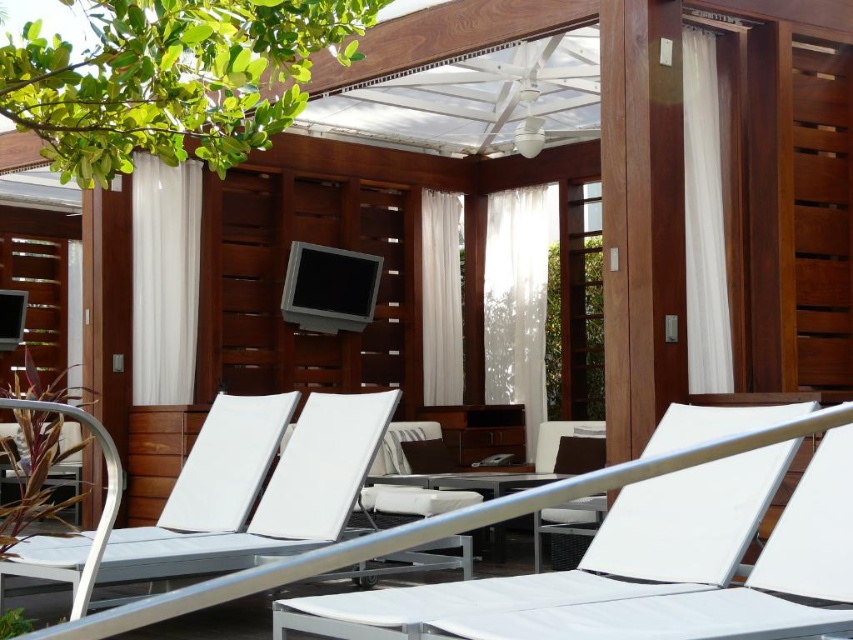
Does white fabric chair at center have a lesser width compared to white matte lounge chair at center?

In fact, white fabric chair at center might be wider than white matte lounge chair at center.

Does white fabric chair at center have a larger size compared to white matte lounge chair at center?

Indeed, white fabric chair at center has a larger size compared to white matte lounge chair at center.

What do you see at coordinates (585, 554) in the screenshot?
I see `white fabric chair at center` at bounding box center [585, 554].

Find the location of `white fabric chair at center`. white fabric chair at center is located at coordinates (585, 554).